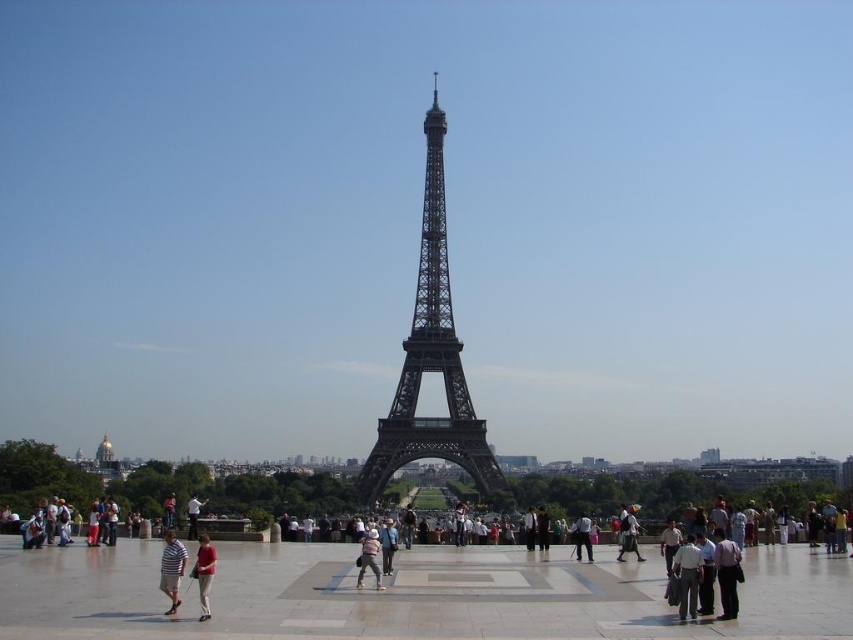
Is point (207, 612) closer to camera compared to point (379, 576)?

No, (207, 612) is behind (379, 576).

Is red cotton shirt at center thinner than light beige fabric hat at center?

Correct, red cotton shirt at center's width is less than light beige fabric hat at center's.

Is point (202, 582) closer to camera compared to point (360, 557)?

That is True.

Image resolution: width=853 pixels, height=640 pixels. Find the location of `red cotton shirt at center`. red cotton shirt at center is located at coordinates (202, 573).

Between point (628, 547) and point (582, 515), which one is positioned in front?

Positioned in front is point (628, 547).

Who is more forward, (x=631, y=532) or (x=573, y=529)?

Point (x=573, y=529)

Where is `light brown leather bag at center`? This screenshot has height=640, width=853. light brown leather bag at center is located at coordinates (628, 532).

Can you confirm if light beige fabric hat at center is bigger than light brown leather bag at center?

Incorrect, light beige fabric hat at center is not larger than light brown leather bag at center.

Does point (376, 582) lie in front of point (625, 518)?

Yes, it is.

You are a GUI agent. You are given a task and a screenshot of the screen. Output one action in this format:
    pyautogui.click(x=<x>, y=<y>)
    Task: Click on the light beige fabric hat at center
    The image size is (853, 640).
    Given the screenshot: What is the action you would take?
    pyautogui.click(x=369, y=557)